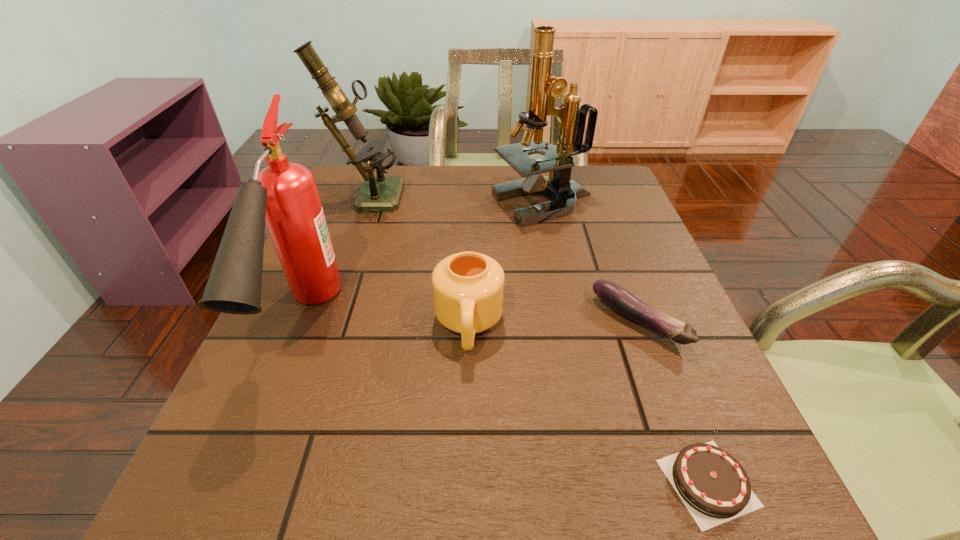
What are the coordinates of `free area in between the right microscope and the left microscope` in the screenshot? It's located at (455, 199).

Find the location of a particular element. free space that is in between the right microscope and the left microscope is located at coordinates (455, 199).

Locate an element on the screen. This screenshot has height=540, width=960. vacant space that's between the left microscope and the right microscope is located at coordinates click(455, 199).

The width and height of the screenshot is (960, 540). In order to click on vacant space in between the right microscope and the nearest object in this screenshot , I will do `click(626, 343)`.

Locate an element on the screen. The height and width of the screenshot is (540, 960). blank region between the fire extinguisher and the fourth tallest object is located at coordinates click(387, 324).

The image size is (960, 540). Identify the location of free area in between the right microscope and the left microscope. point(455,199).

Locate an element on the screen. empty space that is in between the fire extinguisher and the right microscope is located at coordinates tap(423, 264).

Choose which object is the third nearest neighbor to the mug. Please provide its 2D coordinates. Your answer should be formatted as a tuple, i.e. [(x, y)], where the tuple contains the x and y coordinates of a point satisfying the conditions above.

[(544, 87)]

At what (x,y) coordinates should I click in order to perform the action: click on object that is the closest to the fire extinguisher. Please return your answer as a coordinate pair (x, y). The height and width of the screenshot is (540, 960). Looking at the image, I should click on (382, 193).

Identify the location of vacant area in the image that satisfies the following two spatial constraints: 1. at the eyepiece of the right microscope; 2. on the handle side of the third shortest object. The width and height of the screenshot is (960, 540). (567, 325).